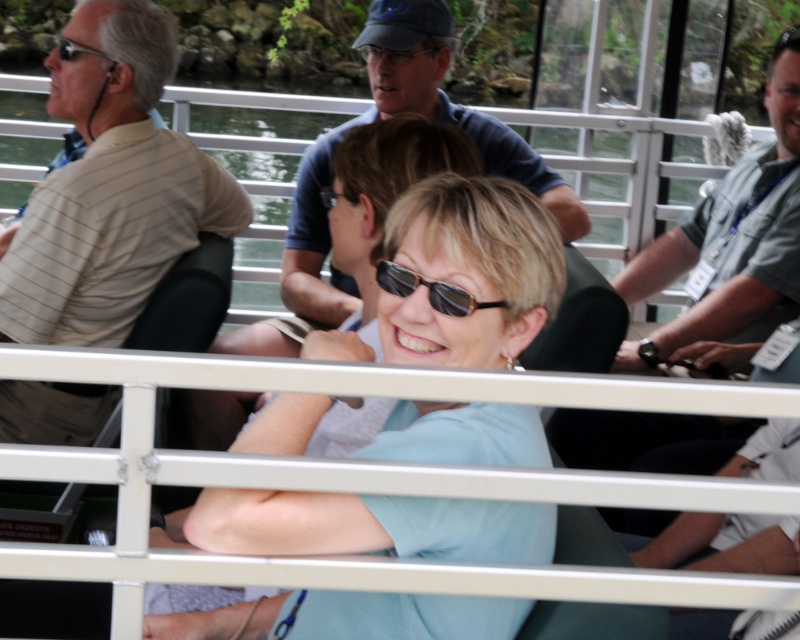
Question: Which object is positioned farthest from the gray fabric shirt at right?

Choices:
 (A) light blue fabric at center
 (B) black plastic sunglasses at center

Answer: (B)

Question: Which point appears closest to the camera in this image?

Choices:
 (A) (410, 545)
 (B) (758, 216)

Answer: (A)

Question: Which object is closer to the camera taking this photo?

Choices:
 (A) gray fabric shirt at right
 (B) light blue fabric at center
 (C) beige striped shirt at left

Answer: (B)

Question: Does gray fabric shirt at right appear on the right side of black plastic sunglasses at center?

Choices:
 (A) yes
 (B) no

Answer: (A)

Question: Can you confirm if beige striped shirt at left is bigger than gray fabric shirt at right?

Choices:
 (A) no
 (B) yes

Answer: (A)

Question: From the image, what is the correct spatial relationship of blue fabric shirt at center in relation to gray fabric shirt at right?

Choices:
 (A) right
 (B) left

Answer: (B)